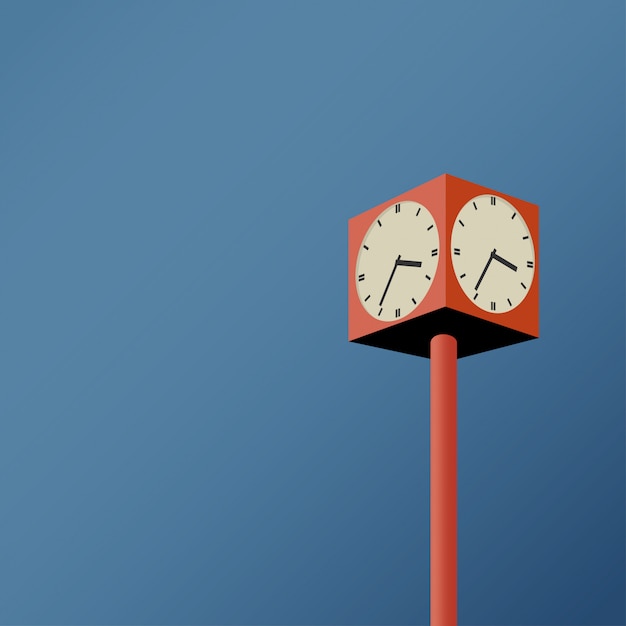
Find the location of a particular element. blank space on top of clock is located at coordinates (468, 121).